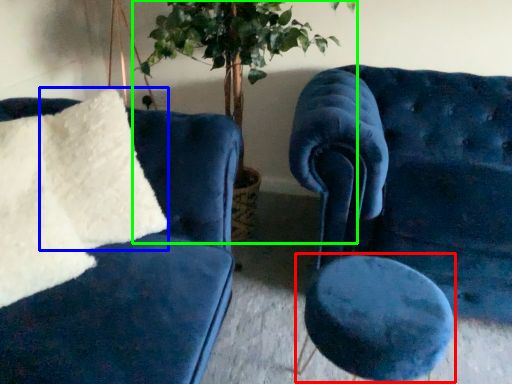
Question: Which object is positioned farthest from stool (highlighted by a red box)? Select from pillow (highlighted by a blue box) and houseplant (highlighted by a green box).

Choices:
 (A) pillow
 (B) houseplant

Answer: (B)